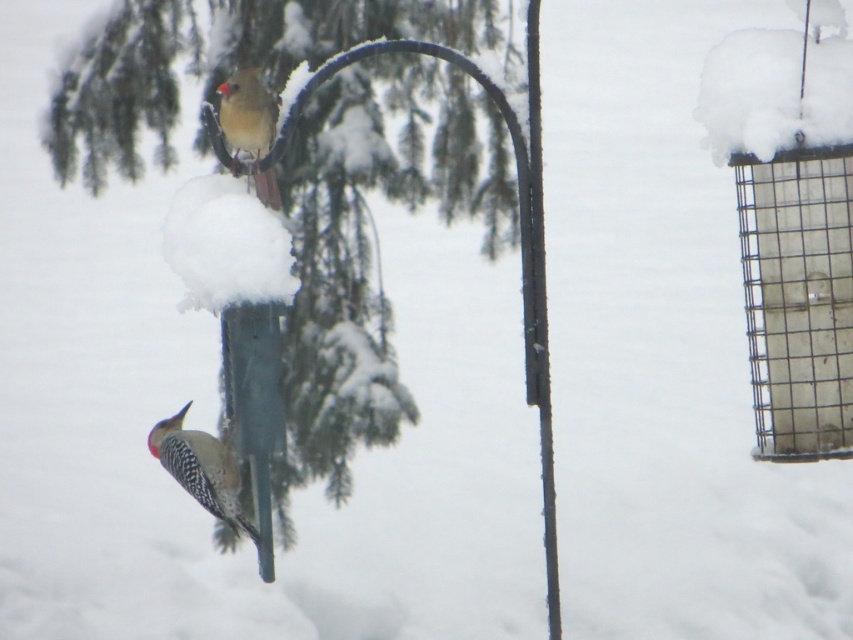
Question: Which point is closer to the camera taking this photo?

Choices:
 (A) (206, 464)
 (B) (537, 170)

Answer: (B)

Question: Which object appears farthest from the camera in this image?

Choices:
 (A) green matte tree at center
 (B) matte brown woodpecker at upper center

Answer: (A)

Question: Is green matte tree at center positioned behind matte brown woodpecker at upper center?

Choices:
 (A) yes
 (B) no

Answer: (A)

Question: Can you confirm if reddish-brown speckled woodpecker at lower left is bigger than matte brown woodpecker at upper center?

Choices:
 (A) yes
 (B) no

Answer: (A)

Question: Which object is positioned farthest from the matte brown woodpecker at upper center?

Choices:
 (A) green matte tree at center
 (B) reddish-brown speckled woodpecker at lower left

Answer: (A)

Question: Can you confirm if reddish-brown speckled woodpecker at lower left is positioned above matte brown woodpecker at upper center?

Choices:
 (A) yes
 (B) no

Answer: (B)